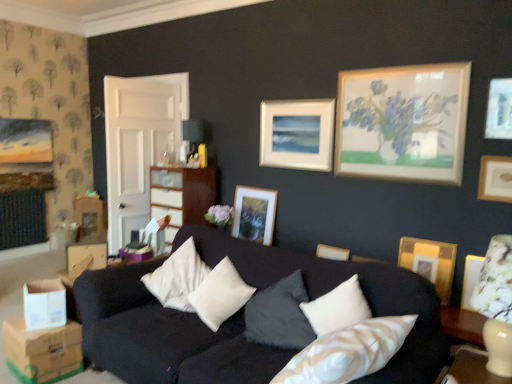
The image size is (512, 384). I want to click on vacant point above matte gold picture frame at center, marked as the 4th picture frame in a right-to-left arrangement (from a real-world perspective), so click(x=253, y=188).